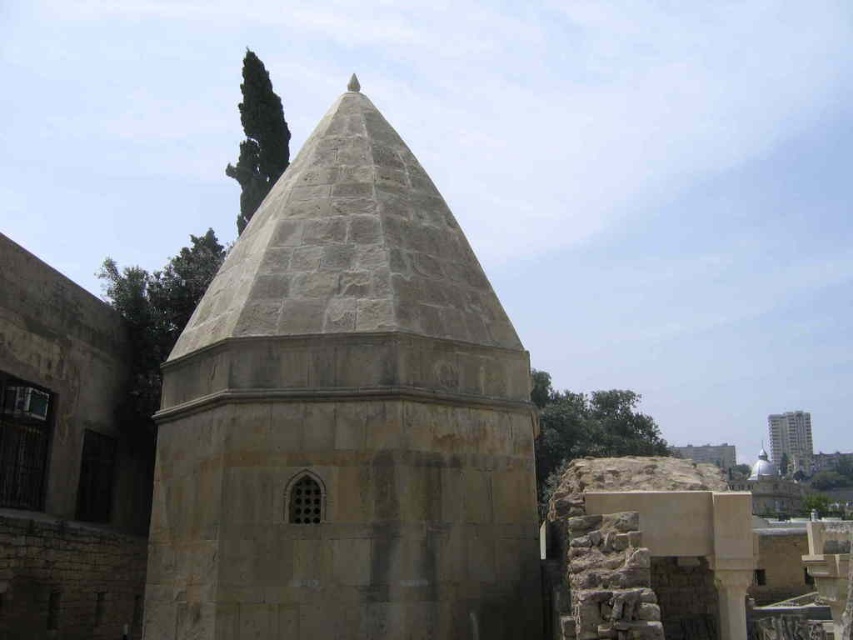
Does gray stone dome at center have a larger size compared to smooth concrete tower at right?

Actually, gray stone dome at center might be smaller than smooth concrete tower at right.

The width and height of the screenshot is (853, 640). What do you see at coordinates (345, 419) in the screenshot?
I see `gray stone dome at center` at bounding box center [345, 419].

Where is `gray stone dome at center`? gray stone dome at center is located at coordinates (345, 419).